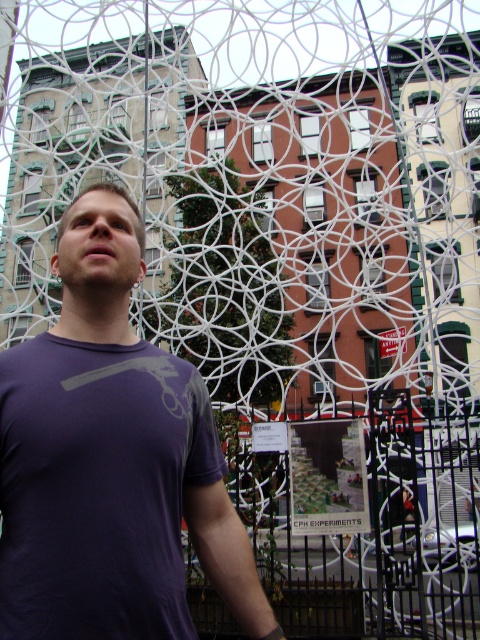
Question: Does purple cotton t-shirt at center appear under black wrought iron fence at center?

Choices:
 (A) no
 (B) yes

Answer: (A)

Question: Is purple cotton t-shirt at center below black wrought iron fence at center?

Choices:
 (A) no
 (B) yes

Answer: (A)

Question: Which point is closer to the camera taking this photo?

Choices:
 (A) (166, 500)
 (B) (382, 545)

Answer: (A)

Question: Does purple cotton t-shirt at center have a lesser width compared to black wrought iron fence at center?

Choices:
 (A) yes
 (B) no

Answer: (A)

Question: Which object appears farthest from the camera in this image?

Choices:
 (A) purple cotton t-shirt at center
 (B) black wrought iron fence at center

Answer: (B)